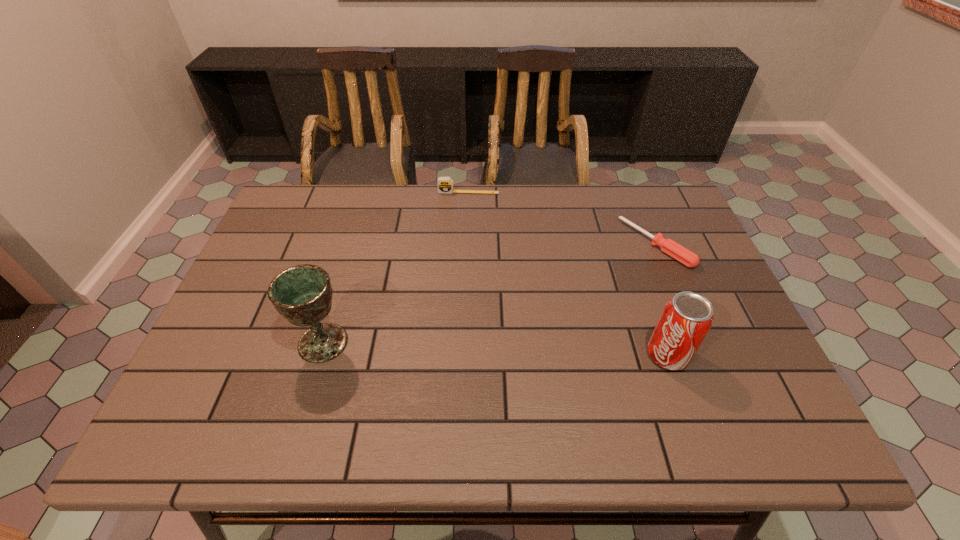
Where is `vacant point located 0.390m at the tip of the shortest object`? vacant point located 0.390m at the tip of the shortest object is located at coordinates (535, 332).

Where is `vacant space positioned at the front of the tape measure with the tape extended`? vacant space positioned at the front of the tape measure with the tape extended is located at coordinates (458, 274).

The height and width of the screenshot is (540, 960). I want to click on vacant area situated 0.370m at the front of the tape measure with the tape extended, so click(x=458, y=276).

Where is `free space located at the front of the tape measure with the tape extended`? free space located at the front of the tape measure with the tape extended is located at coordinates (466, 204).

The height and width of the screenshot is (540, 960). Identify the location of screwdriver located in the far edge section of the desktop. tap(681, 254).

This screenshot has height=540, width=960. I want to click on tape measure present at the far edge, so click(x=445, y=184).

You are a GUI agent. You are given a task and a screenshot of the screen. Output one action in this format:
    pyautogui.click(x=<x>, y=<y>)
    Task: Click on the chalice situated at the near edge
    The height and width of the screenshot is (540, 960).
    Given the screenshot: What is the action you would take?
    pyautogui.click(x=302, y=294)

This screenshot has height=540, width=960. I want to click on soda can that is at the near edge, so click(x=686, y=319).

The height and width of the screenshot is (540, 960). Find the location of `soda can that is positioned at the right edge`. soda can that is positioned at the right edge is located at coordinates (686, 319).

Identify the location of screwdriver at the right edge. The width and height of the screenshot is (960, 540). (681, 254).